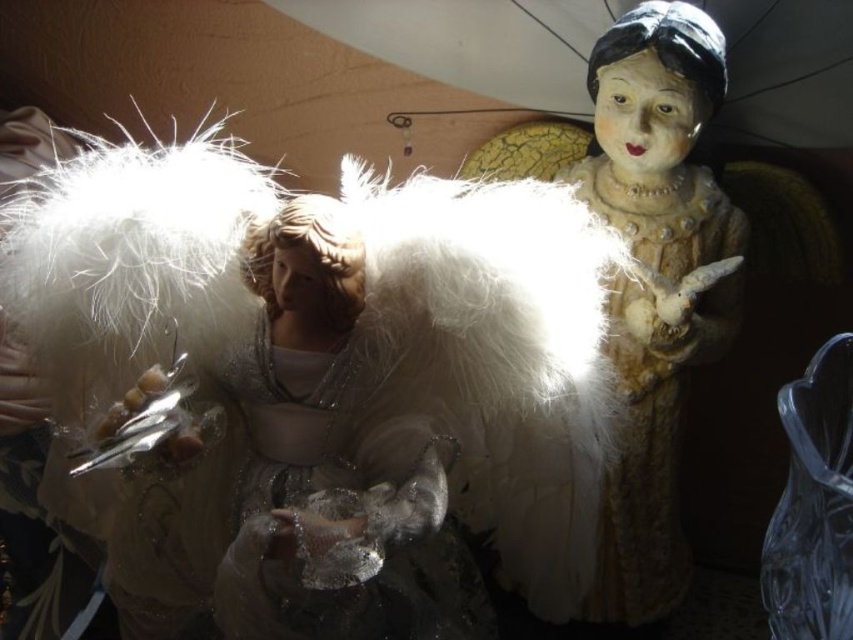
This screenshot has height=640, width=853. Describe the element at coordinates (302, 474) in the screenshot. I see `satin white angel at center` at that location.

Between point (318, 296) and point (643, 525), which one is positioned in front?

Point (318, 296) is in front.

The image size is (853, 640). I want to click on satin white angel at center, so click(x=302, y=474).